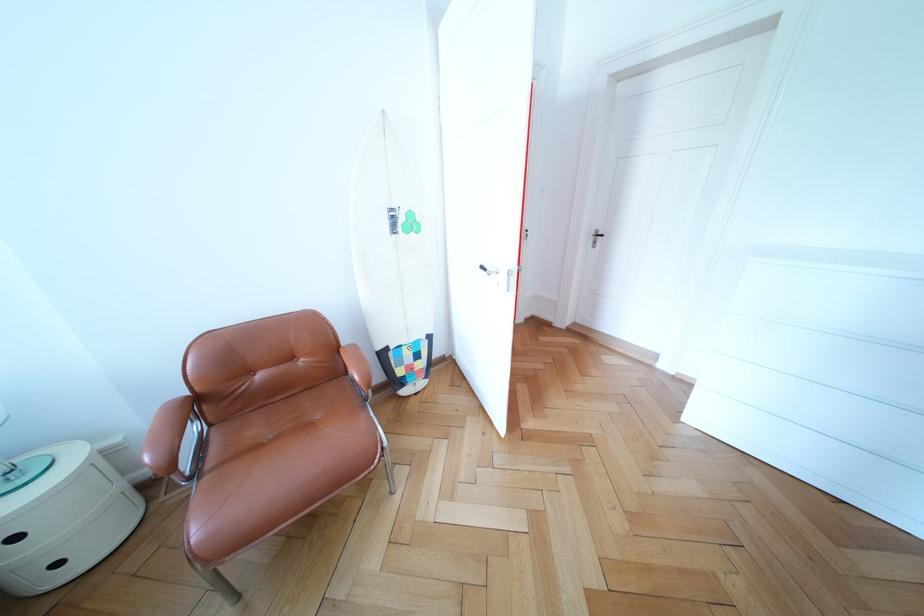
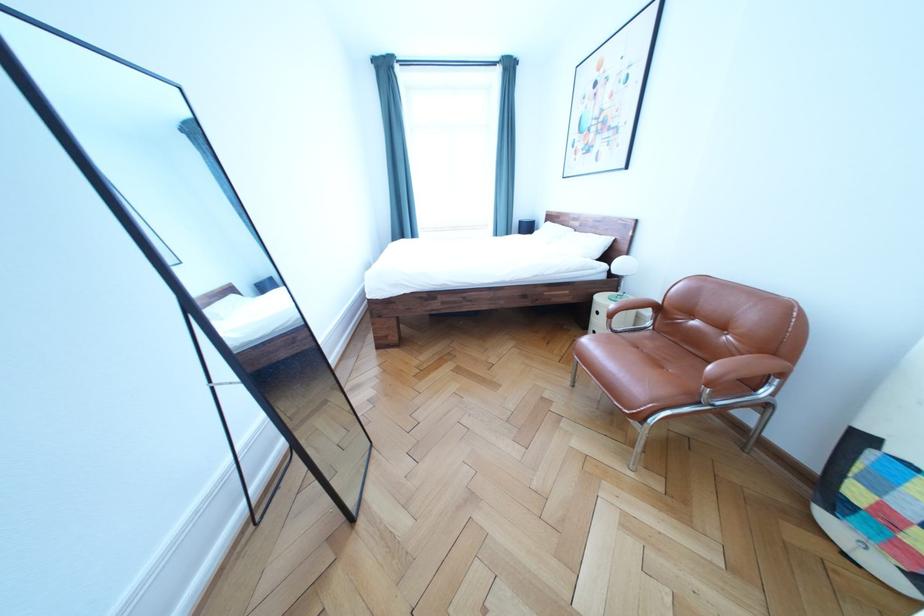
Where in the second image is the point corresponding to point (272, 382) from the first image?

(706, 329)